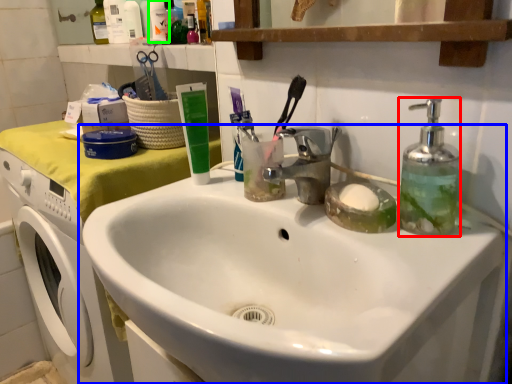
Question: Considering the real-world distances, which object is farthest from soap dispenser (highlighted by a red box)? sink (highlighted by a blue box) or toiletry (highlighted by a green box)?

Choices:
 (A) sink
 (B) toiletry

Answer: (B)